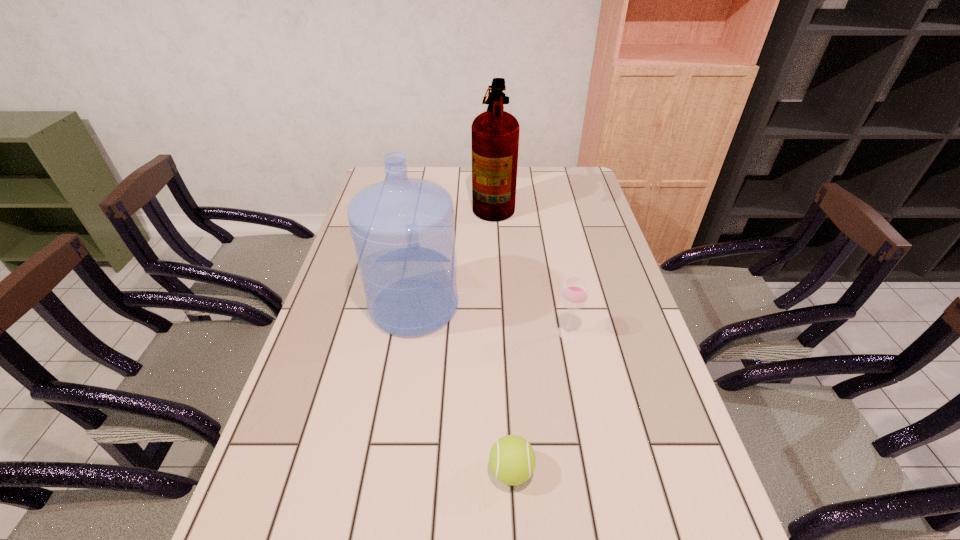
The width and height of the screenshot is (960, 540). I want to click on the farthest object, so click(x=495, y=133).

Find the location of a particular element. water jug is located at coordinates pyautogui.click(x=403, y=229).

I want to click on the third tallest object, so click(575, 290).

The image size is (960, 540). I want to click on wineglass, so click(575, 290).

I want to click on the shortest object, so click(512, 460).

This screenshot has height=540, width=960. Identify the location of tennis ball. (512, 460).

You are a GUI agent. You are given a task and a screenshot of the screen. Output one action in this format:
    pyautogui.click(x=<x>, y=<y>)
    Task: Click on the free point located 0.330m at the nozzle of the farthest object
    
    Given the screenshot: What is the action you would take?
    pyautogui.click(x=384, y=202)

Where is `free space located at the nozzle of the farthest object`? free space located at the nozzle of the farthest object is located at coordinates (372, 202).

Where is `free location located at the nozzle of the farthest object`? free location located at the nozzle of the farthest object is located at coordinates (443, 202).

At what (x,y) coordinates should I click in order to perform the action: click on free space located 0.390m on the side of the leftmost object with the handle. Please return your answer as a coordinate pair (x, y). The height and width of the screenshot is (540, 960). Looking at the image, I should click on 430,207.